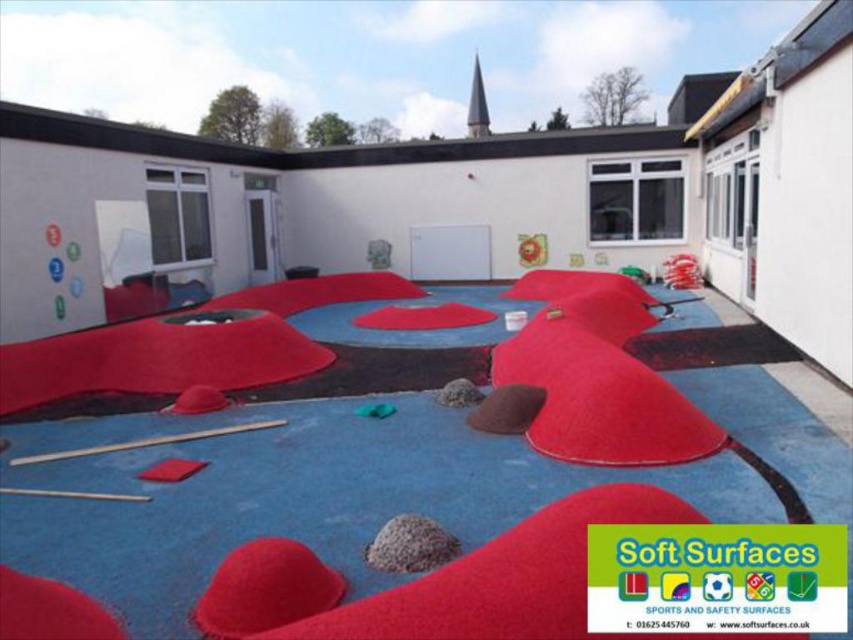
Is point (305, 346) positioned after point (374, 416)?

Yes, point (305, 346) is behind point (374, 416).

The height and width of the screenshot is (640, 853). I want to click on velvet red carpet at center, so click(x=155, y=358).

Who is lower down, red rubberized mat at center or green rubber ball at center?

Positioned lower is green rubber ball at center.

Can you confirm if red rubberized mat at center is positioned to the right of green rubber ball at center?

Correct, you'll find red rubberized mat at center to the right of green rubber ball at center.

Who is more forward, (x=450, y=301) or (x=364, y=410)?

Point (x=364, y=410)

Where is `red rubberized mat at center`? This screenshot has height=640, width=853. red rubberized mat at center is located at coordinates (424, 316).

From the picture: Can you confirm if velvet red carpet at center is positioned to the right of red rubberized mat at center?

Incorrect, velvet red carpet at center is not on the right side of red rubberized mat at center.

Who is more forward, (183,323) or (492,314)?

Point (183,323) is more forward.

Where is `velvet red carpet at center`? velvet red carpet at center is located at coordinates coord(155,358).